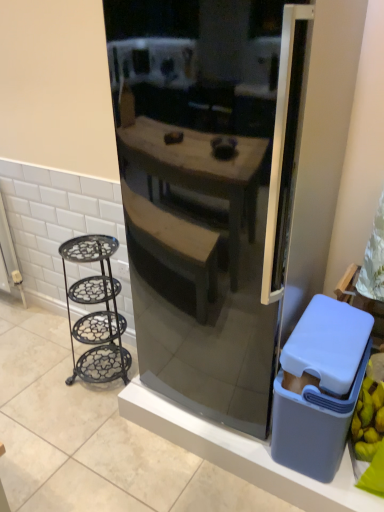
Question: From a real-world perspective, relative to gray plastic trash bin at right, is black wrought iron stand at left vertically above or below?

Choices:
 (A) above
 (B) below

Answer: (B)

Question: Based on their sizes in the image, would you say black wrought iron stand at left is bigger or smaller than gray plastic trash bin at right?

Choices:
 (A) big
 (B) small

Answer: (A)

Question: Which of these objects is positioned farthest from the satin black refrigerator at center?

Choices:
 (A) black wrought iron stand at left
 (B) gray plastic bin at lower right
 (C) gray plastic trash bin at right

Answer: (B)

Question: Which object is the farthest from the gray plastic trash bin at right?

Choices:
 (A) black wrought iron stand at left
 (B) satin black refrigerator at center
 (C) gray plastic bin at lower right

Answer: (A)